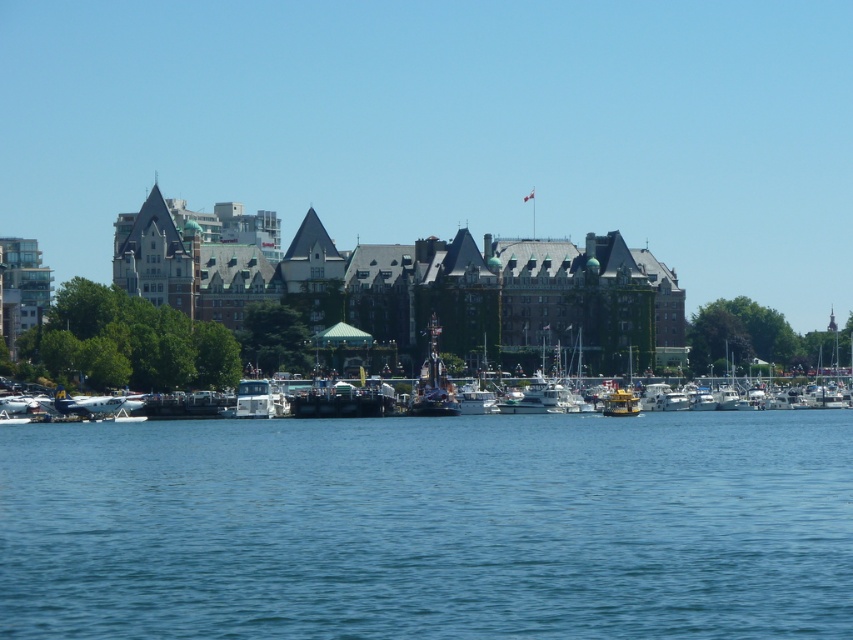
Is point (38, 560) more distant than point (132, 342)?

No, it is not.

Does blue water at center have a smaller size compared to white glossy boat at center?

No, blue water at center is not smaller than white glossy boat at center.

Between point (572, 592) and point (144, 326), which one is positioned in front?

Point (572, 592) is more forward.

Find the location of a particular element. This screenshot has width=853, height=640. blue water at center is located at coordinates (430, 525).

How distant is blue water at center from shiny silver statue at center?

blue water at center and shiny silver statue at center are 26.73 meters apart from each other.

Is point (80, 538) positioned in front of point (410, 401)?

Yes, it is.

I want to click on blue water at center, so coord(430,525).

Does white glossy boat at center have a larger size compared to shiny silver statue at center?

Indeed, white glossy boat at center has a larger size compared to shiny silver statue at center.

Does white glossy boat at center have a lesser height compared to shiny silver statue at center?

No, white glossy boat at center is not shorter than shiny silver statue at center.

Where is `white glossy boat at center`? white glossy boat at center is located at coordinates (97, 349).